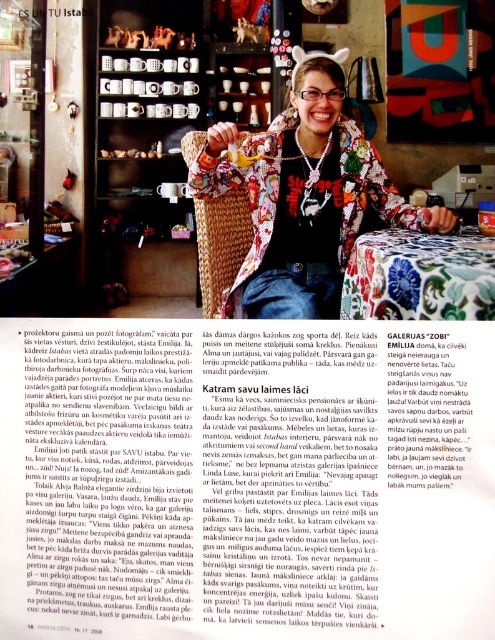
This screenshot has height=640, width=495. Identify the location of blacktextured fabricmagazine at center. (247, 477).

Who is positioned more to the right, blacktextured fabricmagazine at center or floral fabric jacket at center?

floral fabric jacket at center

Where is `blacktextured fabricmagazine at center`? Image resolution: width=495 pixels, height=640 pixels. blacktextured fabricmagazine at center is located at coordinates (247, 477).

Find the location of a particular element. blacktextured fabricmagazine at center is located at coordinates click(x=247, y=477).

Can you confirm if blacktextured fabricmagazine at center is thinner than smooth brown bread at center?

Indeed, blacktextured fabricmagazine at center has a lesser width compared to smooth brown bread at center.

Is blacktextured fabricmagazine at center below smooth brown bread at center?

Correct, blacktextured fabricmagazine at center is located below smooth brown bread at center.

Locate an element on the screen. The image size is (495, 640). blacktextured fabricmagazine at center is located at coordinates click(x=247, y=477).

Which is behind, point (379, 176) or point (101, 154)?

The point (101, 154) is behind.

Based on the photo, who is higher up, floral fabric jacket at center or smooth brown bread at center?

smooth brown bread at center is above.

Identify the location of floral fabric jacket at center. This screenshot has width=495, height=640. (303, 195).